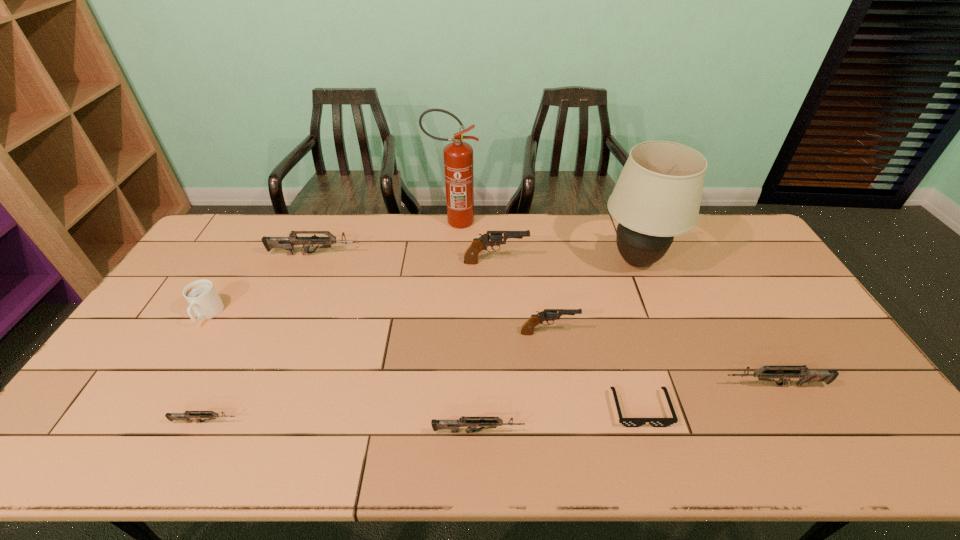
In order to click on the farthest object in this screenshot , I will do `click(458, 156)`.

Where is `red fire extinguisher`? This screenshot has height=540, width=960. red fire extinguisher is located at coordinates (458, 156).

You are a GUI agent. You are given a task and a screenshot of the screen. Output one action in this format:
    pyautogui.click(x=<x>, y=<y>)
    Task: Click on the lampshade
    The width and height of the screenshot is (960, 540).
    Given the screenshot: What is the action you would take?
    pyautogui.click(x=658, y=194)

Where is `the farther black gun`? The width and height of the screenshot is (960, 540). the farther black gun is located at coordinates (492, 238).

Image resolution: width=960 pixels, height=540 pixels. In order to click on the bigger black gun in this screenshot , I will do `click(492, 238)`.

Locate an element on the screen. the fourth nearest gun is located at coordinates (547, 315).

Identify the location of the fifth nearest object. The image size is (960, 540). (547, 315).

Where is `the farthest gun`? This screenshot has height=540, width=960. the farthest gun is located at coordinates (287, 243).

What are the coordinates of `the biggest grey gun` in the screenshot? It's located at (287, 243).

At what (x,y) coordinates should I click in order to perform the action: click on the fifth farthest object. Please return your answer as a coordinate pair (x, y). The height and width of the screenshot is (540, 960). Looking at the image, I should click on (203, 299).